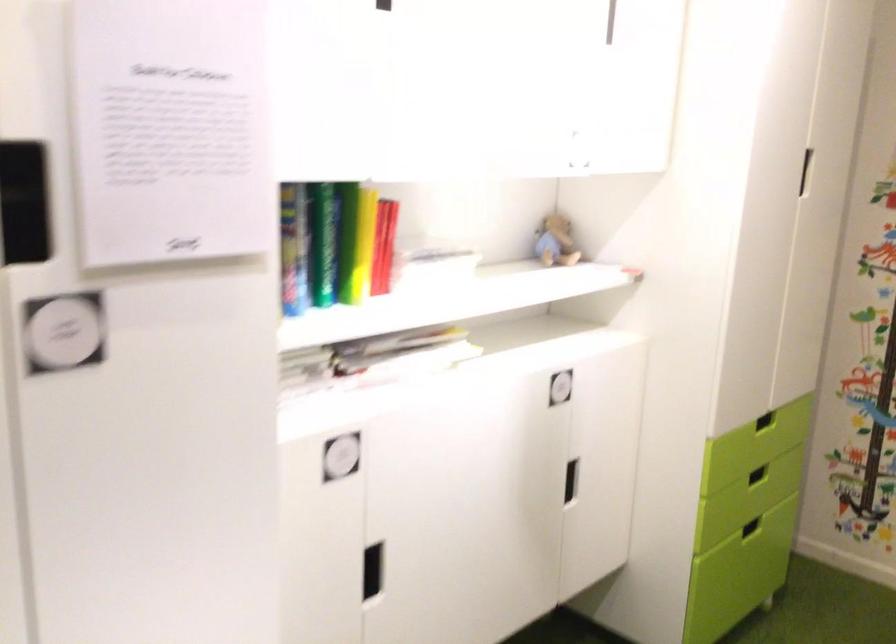
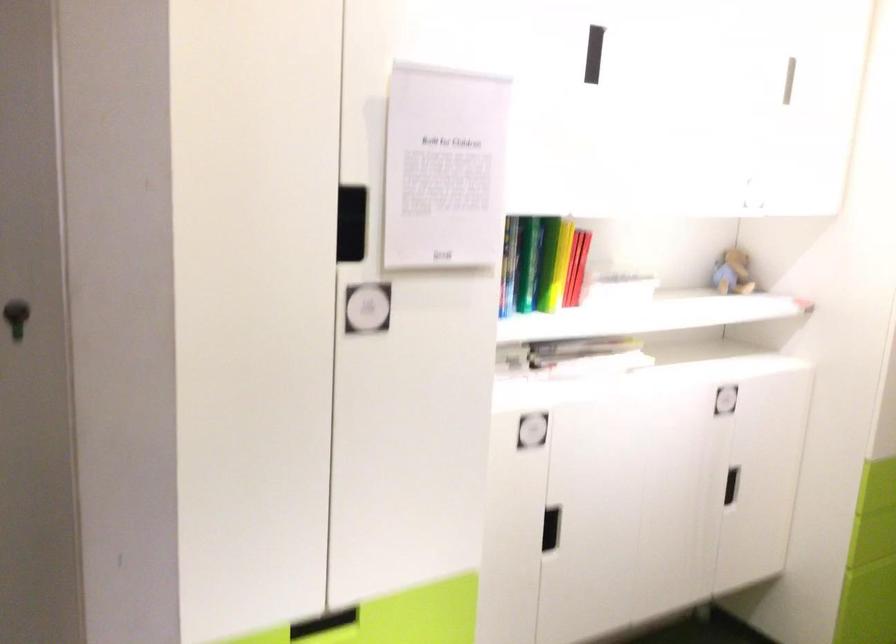
The point at [386,243] is marked in the first image. Where is the corresponding point in the second image?

(576, 267)